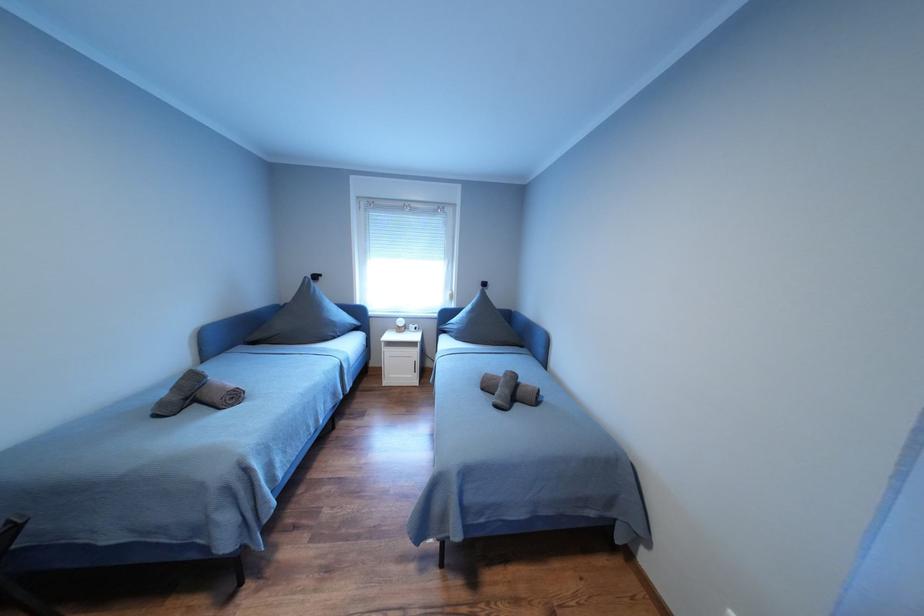
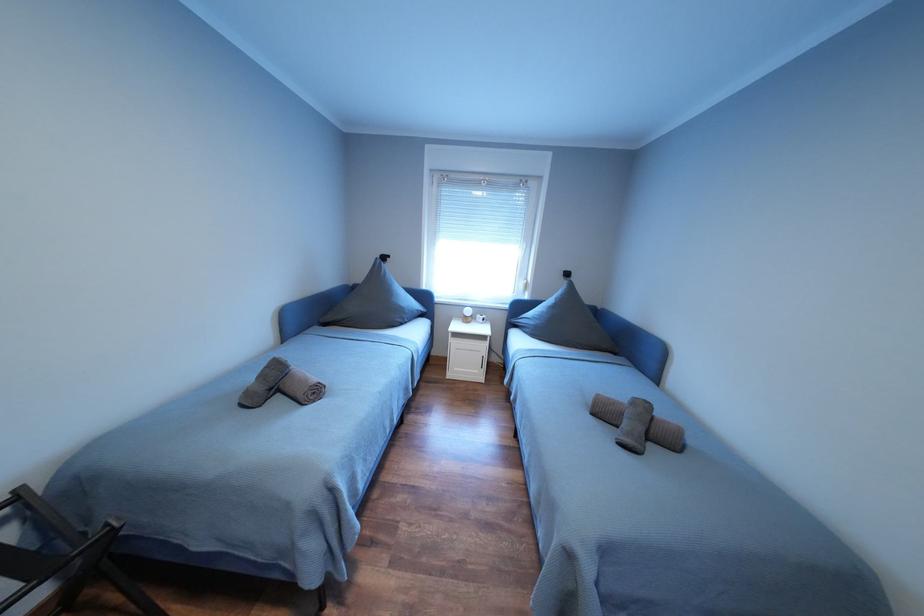
What movement of the cameraman would produce the second image?

The cameraman walked toward left, forward.